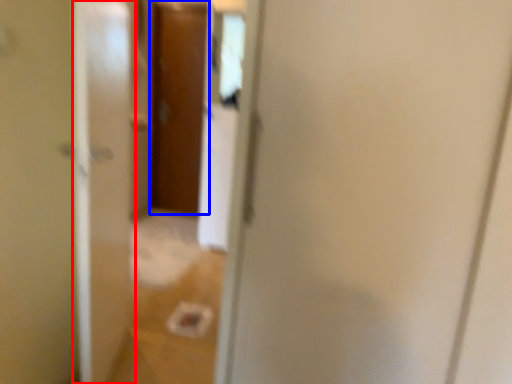
Question: Which object appears closest to the camera in this image, screen door (highlighted by a red box) or door (highlighted by a blue box)?

Choices:
 (A) screen door
 (B) door

Answer: (A)